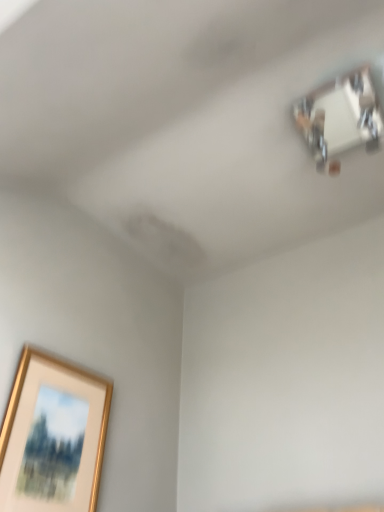
In order to face metallic reflective mirror at upper right, should I rotate leftwards or rightwards?

You should look right and rotate roughly 20.708 degrees.

Measure the distance between metallic reflective mirror at upper right and camera.

They are 1.08 meters apart.

What is the approximate width of metallic reflective mirror at upper right?

The width of metallic reflective mirror at upper right is 10.59 inches.

At what (x,y) coordinates should I click in order to perform the action: click on metallic reflective mirror at upper right. Please return your answer as a coordinate pair (x, y). Looking at the image, I should click on (340, 118).

Image resolution: width=384 pixels, height=512 pixels. What do you see at coordinates (340, 118) in the screenshot? I see `metallic reflective mirror at upper right` at bounding box center [340, 118].

The image size is (384, 512). What are the coordinates of `gold metallic picture frame at lower left` in the screenshot? It's located at (32, 421).

The image size is (384, 512). What do you see at coordinates (32, 421) in the screenshot?
I see `gold metallic picture frame at lower left` at bounding box center [32, 421].

Find the location of a particular element. Image resolution: width=384 pixels, height=512 pixels. metallic reflective mirror at upper right is located at coordinates (340, 118).

Can you confirm if gold metallic picture frame at lower left is positioned to the left of metallic reflective mirror at upper right?

Answer: Yes.

Is the position of gold metallic picture frame at lower left more distant than that of metallic reflective mirror at upper right?

No, the depth of gold metallic picture frame at lower left is less than that of metallic reflective mirror at upper right.

Is point (38, 370) more distant than point (325, 115)?

No, (38, 370) is in front of (325, 115).

From the image's perspective, which object appears higher, gold metallic picture frame at lower left or metallic reflective mirror at upper right?

metallic reflective mirror at upper right is shown above in the image.

From a real-world perspective, is gold metallic picture frame at lower left on metallic reflective mirror at upper right?

No, from a real-world perspective, gold metallic picture frame at lower left is not above metallic reflective mirror at upper right.

Between gold metallic picture frame at lower left and metallic reflective mirror at upper right, which one has larger width?

metallic reflective mirror at upper right is wider.

Considering the sizes of objects gold metallic picture frame at lower left and metallic reflective mirror at upper right in the image provided, who is taller, gold metallic picture frame at lower left or metallic reflective mirror at upper right?

gold metallic picture frame at lower left.

Between gold metallic picture frame at lower left and metallic reflective mirror at upper right, which one has smaller size?

Smaller between the two is gold metallic picture frame at lower left.

Is gold metallic picture frame at lower left situated inside metallic reflective mirror at upper right or outside?

gold metallic picture frame at lower left exists outside the volume of metallic reflective mirror at upper right.

Is the surface of gold metallic picture frame at lower left in direct contact with metallic reflective mirror at upper right?

No, gold metallic picture frame at lower left is not touching metallic reflective mirror at upper right.

Could you tell me if gold metallic picture frame at lower left is facing metallic reflective mirror at upper right?

No, gold metallic picture frame at lower left does not turn towards metallic reflective mirror at upper right.

The height and width of the screenshot is (512, 384). Identify the location of wide that is behind the gold metallic picture frame at lower left. pos(340,118).

Does metallic reflective mirror at upper right appear on the right side of gold metallic picture frame at lower left?

Indeed, metallic reflective mirror at upper right is positioned on the right side of gold metallic picture frame at lower left.

Which is behind, metallic reflective mirror at upper right or gold metallic picture frame at lower left?

metallic reflective mirror at upper right is further from the camera.

Considering the points (330, 101) and (10, 421), which point is behind, point (330, 101) or point (10, 421)?

The point (330, 101) is farther.

From the image's perspective, does metallic reflective mirror at upper right appear lower than gold metallic picture frame at lower left?

No, from the image's perspective, metallic reflective mirror at upper right is not below gold metallic picture frame at lower left.

From a real-world perspective, is metallic reflective mirror at upper right physically below gold metallic picture frame at lower left?

No, from a real-world perspective, metallic reflective mirror at upper right is not beneath gold metallic picture frame at lower left.

Which of these two, metallic reflective mirror at upper right or gold metallic picture frame at lower left, is wider?

With larger width is metallic reflective mirror at upper right.

Which of these two, metallic reflective mirror at upper right or gold metallic picture frame at lower left, stands shorter?

metallic reflective mirror at upper right.

Between metallic reflective mirror at upper right and gold metallic picture frame at lower left, which one has smaller size?

Smaller between the two is gold metallic picture frame at lower left.

Which is correct: metallic reflective mirror at upper right is inside gold metallic picture frame at lower left, or outside of it?

metallic reflective mirror at upper right exists outside the volume of gold metallic picture frame at lower left.

Is metallic reflective mirror at upper right touching gold metallic picture frame at lower left?

No, metallic reflective mirror at upper right is not with gold metallic picture frame at lower left.

Could you tell me if metallic reflective mirror at upper right is turned towards gold metallic picture frame at lower left?

No, metallic reflective mirror at upper right does not turn towards gold metallic picture frame at lower left.

The width and height of the screenshot is (384, 512). Find the location of `picture frame on the left of metallic reflective mirror at upper right`. picture frame on the left of metallic reflective mirror at upper right is located at coordinates (32, 421).

The width and height of the screenshot is (384, 512). In order to click on wide behind the gold metallic picture frame at lower left in this screenshot , I will do `click(340, 118)`.

The height and width of the screenshot is (512, 384). There is a gold metallic picture frame at lower left. Find the location of `wide above it (from a real-world perspective)`. wide above it (from a real-world perspective) is located at coordinates (340, 118).